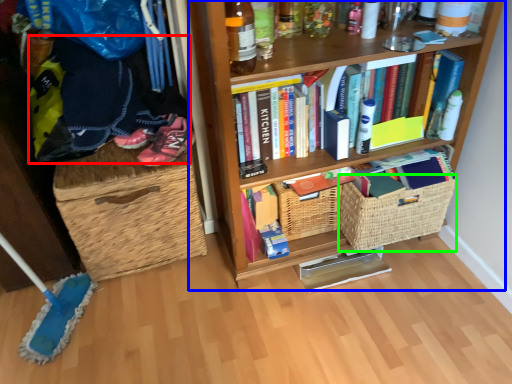
Question: Estimate the real-world distances between objects in this image. Which object is closer to clothing (highlighted by a red box), bookcase (highlighted by a blue box) or basket (highlighted by a green box)?

Choices:
 (A) bookcase
 (B) basket

Answer: (A)